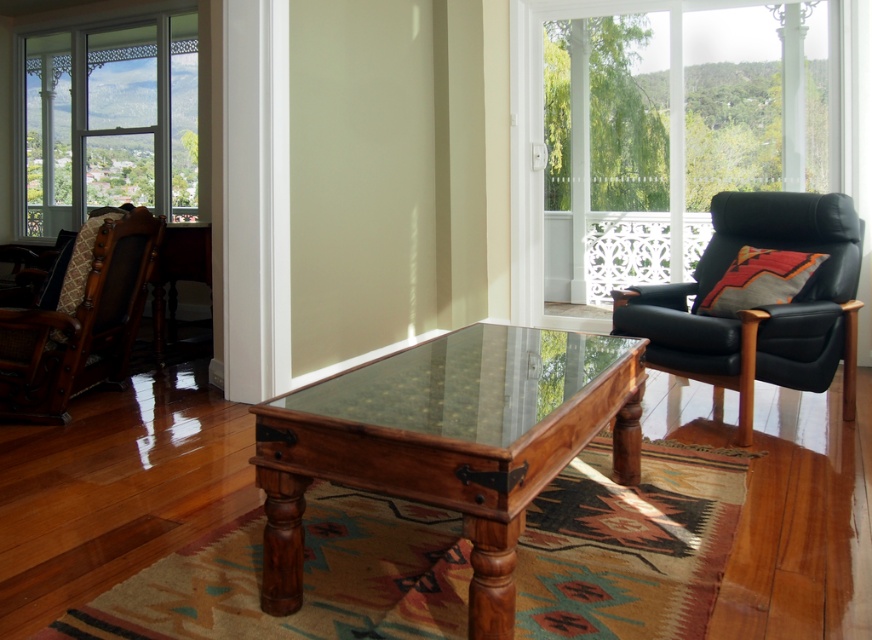
Question: Is brown wood table at center behind black leather armchair at right?

Choices:
 (A) no
 (B) yes

Answer: (A)

Question: Can you confirm if brown wood table at center is positioned above brown woven fabric rocking chair at left?

Choices:
 (A) no
 (B) yes

Answer: (A)

Question: Which object is farther from the camera taking this photo?

Choices:
 (A) brown wood table at center
 (B) clear glass window at upper left
 (C) brown woven fabric rocking chair at left

Answer: (B)

Question: Is clear glass window at upper left smaller than black leather armchair at right?

Choices:
 (A) no
 (B) yes

Answer: (A)

Question: Which object appears closest to the camera in this image?

Choices:
 (A) brown woven fabric rocking chair at left
 (B) orange-red woven cushion at right
 (C) black leather armchair at right
 (D) clear glass window at upper left

Answer: (C)

Question: Which object is closer to the camera taking this photo?

Choices:
 (A) brown woven fabric rocking chair at left
 (B) brown wood table at center
 (C) black leather armchair at right

Answer: (B)